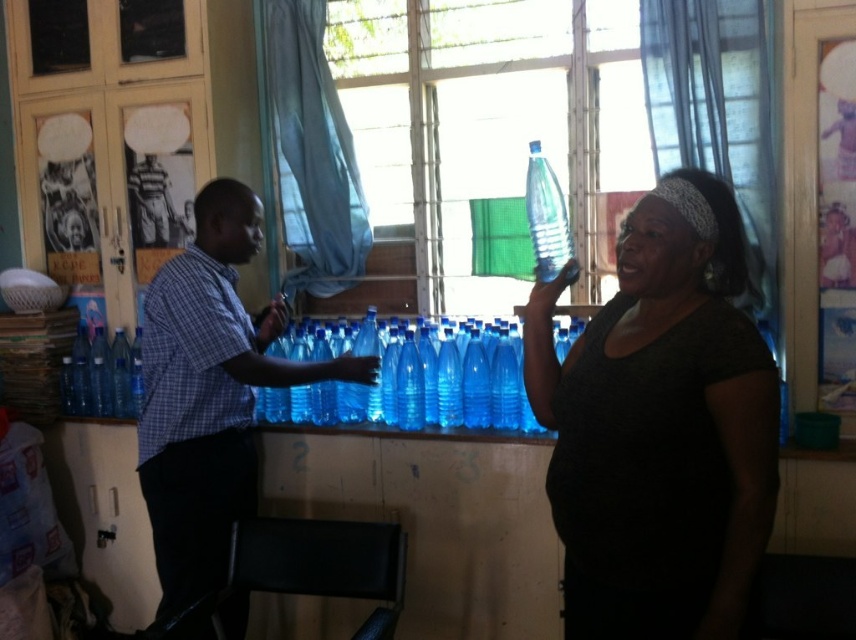
In the scene, there are two people talking. The person on the left is wearing a checkered shirt and the person on the right has a point labeled at coordinates (660, 426). What color is the shirt of the person represented by the point?

The point at (660, 426) represents the matte black shirt at center, so the shirt is matte black.

You are organizing a small event and need to place a 15 cm wide decorative item on a shelf. You have the matte black shirt at center and the blue plastic bottle at center in the image. Which object should you choose to ensure the item fits without overlapping?

The blue plastic bottle at center is narrower than the matte black shirt at center. Since the decorative item is 15 cm wide, you should choose the blue plastic bottle at center to place it on the shelf as it requires less space.

You are organizing a small meeting in this room and need to place two blue plastic bottles on the table. You have a blue plastic water bottles at center and a blue plastic bottle at center. Which one is taller and should be placed first to ensure stability?

The blue plastic water bottles at center is taller than the blue plastic bottle at center, so placing the taller one first would provide better stability.